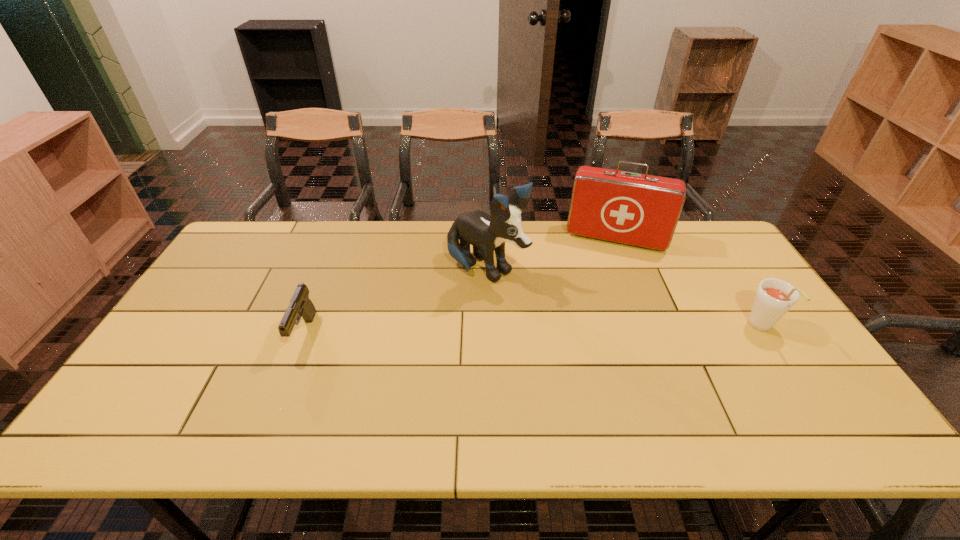
Image resolution: width=960 pixels, height=540 pixels. I want to click on vacant region at the near edge of the desktop, so click(352, 404).

The image size is (960, 540). In the image, there is a desktop. What are the coordinates of `vacant area at the left edge` in the screenshot? It's located at (212, 323).

The width and height of the screenshot is (960, 540). Identify the location of vacant space at the right edge. (790, 347).

You are a GUI agent. You are given a task and a screenshot of the screen. Output one action in this format:
    pyautogui.click(x=<x>, y=<y>)
    Task: Click on the vacant space at the far left corner of the desktop
    
    Given the screenshot: What is the action you would take?
    pyautogui.click(x=253, y=231)

Locate an element on the screen. vacant space at the far right corner is located at coordinates (698, 227).

At what (x,y) coordinates should I click in order to perform the action: click on vacant space at the near right corner of the desktop. Please return your answer as a coordinate pair (x, y). This screenshot has width=960, height=540. Looking at the image, I should click on (828, 386).

The width and height of the screenshot is (960, 540). Identify the location of vacant point located between the shortest object and the puppy. (396, 302).

Where is `vacant space in between the second shortest object and the second object from left to right`? This screenshot has height=540, width=960. vacant space in between the second shortest object and the second object from left to right is located at coordinates (624, 299).

Where is `free spot between the third object from left to right and the rightmost object`? Image resolution: width=960 pixels, height=540 pixels. free spot between the third object from left to right and the rightmost object is located at coordinates (689, 284).

You are a GUI agent. You are given a task and a screenshot of the screen. Output one action in this format:
    pyautogui.click(x=<x>, y=<y>)
    Task: Click on the free space that is in between the third shortest object and the puppy
    
    Given the screenshot: What is the action you would take?
    pyautogui.click(x=551, y=254)